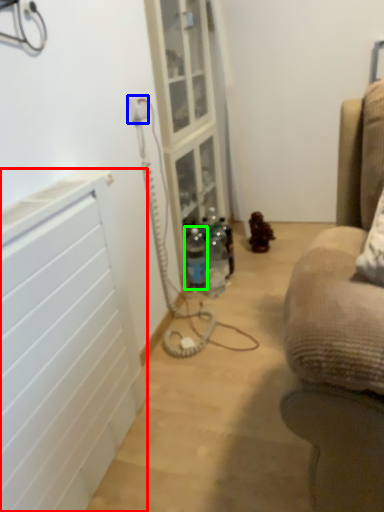
Question: Estimate the real-world distances between objects in this image. Which object is closer to radiator (highlighted by a red box), electric outlet (highlighted by a blue box) or bottle (highlighted by a green box)?

Choices:
 (A) electric outlet
 (B) bottle

Answer: (A)